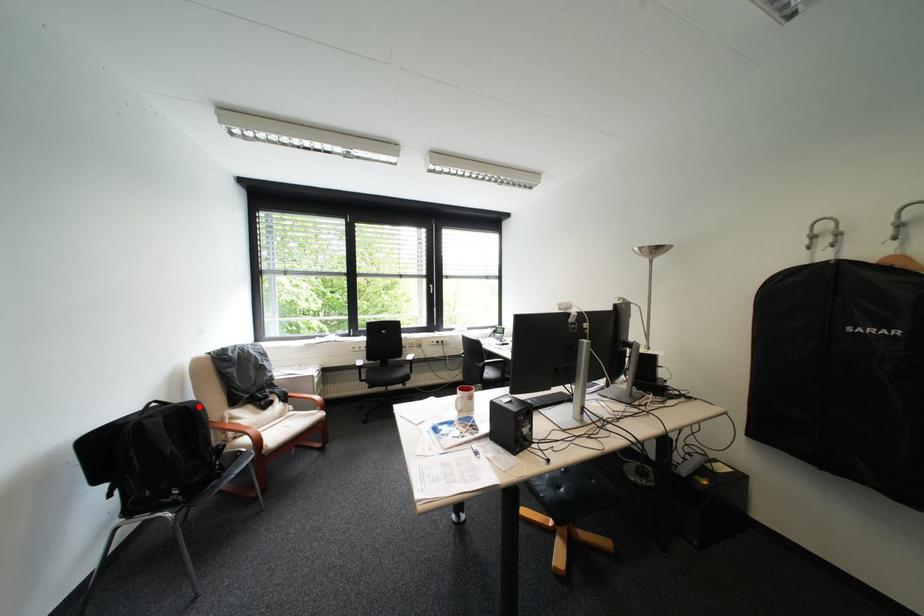
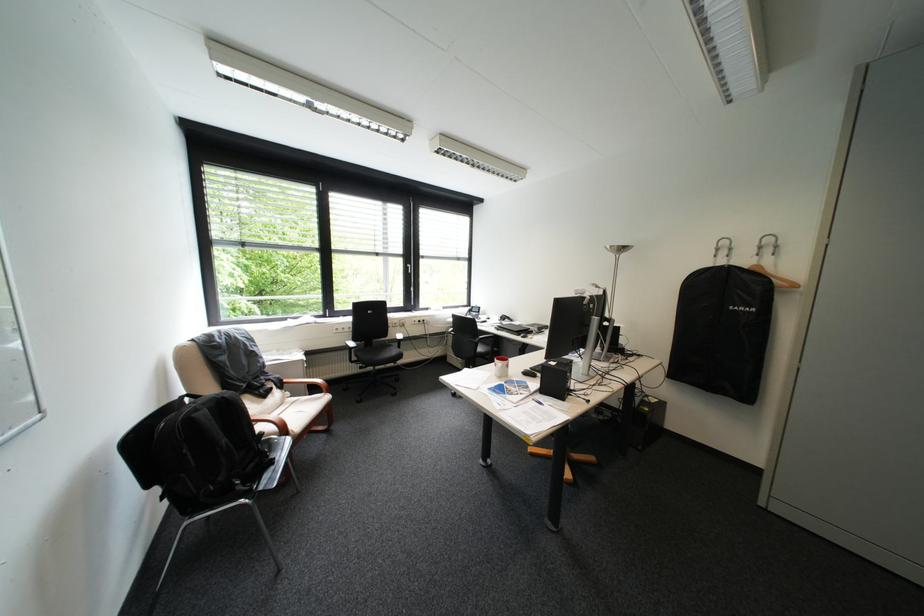
Where in the second image is the point corresponding to the highlighted location from the first image?

(236, 398)